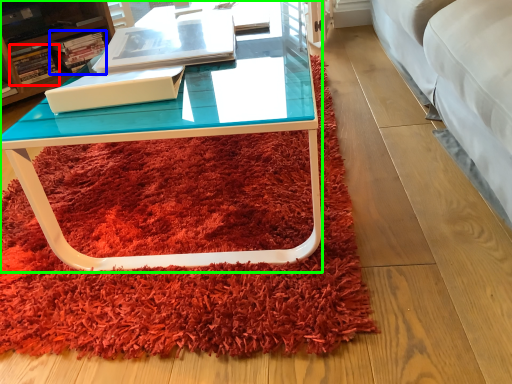
Question: Based on their relative distances, which object is farther from book (highlighted by a red box)? Choose from book (highlighted by a blue box) and coffee table (highlighted by a green box).

Choices:
 (A) book
 (B) coffee table

Answer: (B)